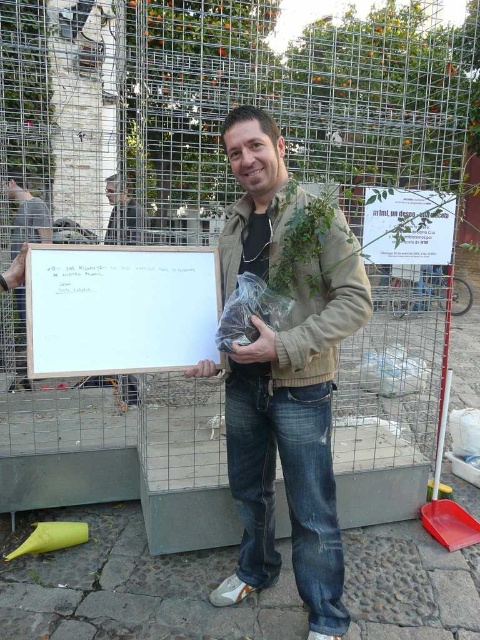
You are a photographer trying to capture both the brown leather jacket at center and the matte white board at center in a single frame. Based on their sizes, which object should you focus on first to ensure both are in the frame?

The brown leather jacket at center is smaller than the matte white board at center, so you should focus on the matte white board at center first to ensure both fit in the frame.

You are a delivery person trying to hand over a package to the man in the scene. The package is too large to fit in your hands while holding both the matte white board at center and the matte black jacket at center. Which object should you ask him to put down first to make space?

The matte white board at center has a smaller size compared to matte black jacket at center, so you should ask him to put down the matte white board at center first to make space.